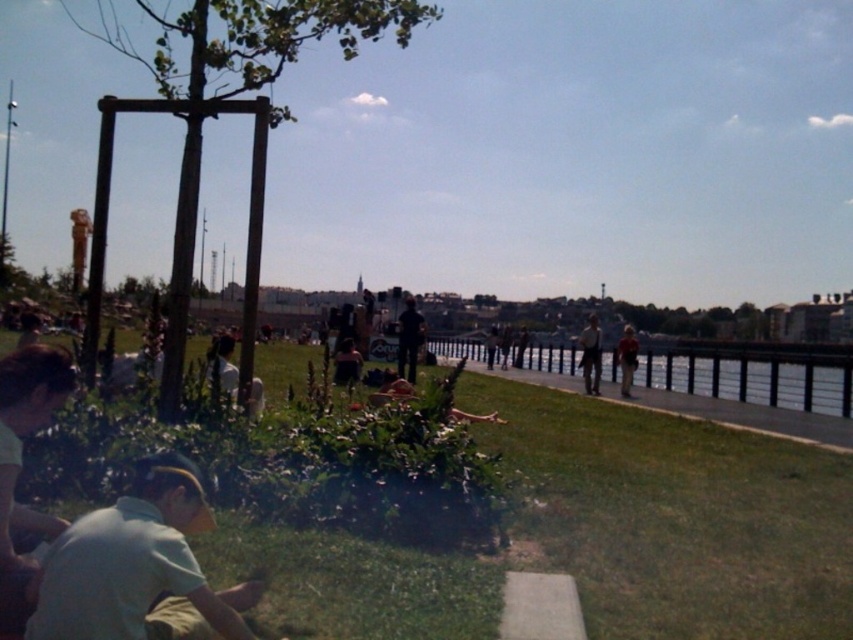
Question: Observing the image, what is the correct spatial positioning of light brown leather jacket at center in reference to light brown leather jacket at center-right?

Choices:
 (A) right
 (B) left

Answer: (A)

Question: Which object is positioned closest to the clear glass waterway at center?

Choices:
 (A) light green fabric shirt at lower left
 (B) dark blue jeans at center
 (C) light brown leather jacket at center
 (D) green grass at lower center

Answer: (B)

Question: Which object is the farthest from the dark blue jeans at center?

Choices:
 (A) light brown leather jacket at center-right
 (B) light brown leather jacket at center
 (C) green grass at lower center
 (D) clear glass waterway at center

Answer: (A)

Question: Does light brown leather jacket at center have a larger size compared to light brown leather jacket at center-right?

Choices:
 (A) yes
 (B) no

Answer: (A)

Question: Does light green fabric shirt at lower left appear on the right side of clear glass waterway at center?

Choices:
 (A) yes
 (B) no

Answer: (B)

Question: Which object is positioned closest to the light brown leather jacket at center-right?

Choices:
 (A) light green fabric shirt at lower left
 (B) green grass at lower center
 (C) dark blue jeans at center
 (D) clear glass waterway at center

Answer: (C)